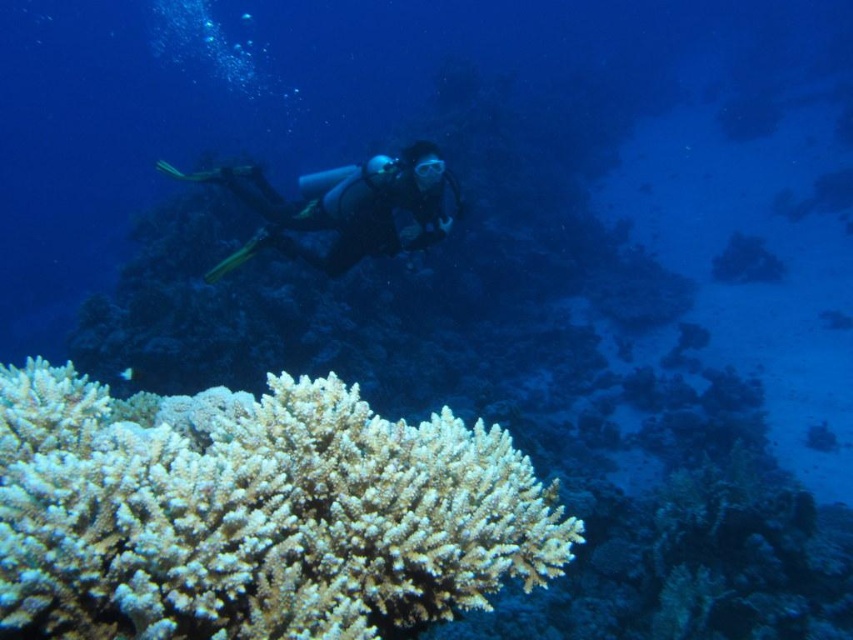
You are a scuba diver navigating underwater. You see two points marked in the scene. Which point is closer to you, point (100, 625) or point (410, 196)?

Point (100, 625) is in front of point (410, 196), so it is closer to you.

You are a marine biologist studying underwater ecosystems. You observe the white coral at lower left and the black matte scuba diver at center in the image. Which object is shorter in height?

The white coral at lower left is not as tall as the black matte scuba diver at center, so the white coral at lower left is shorter in height.